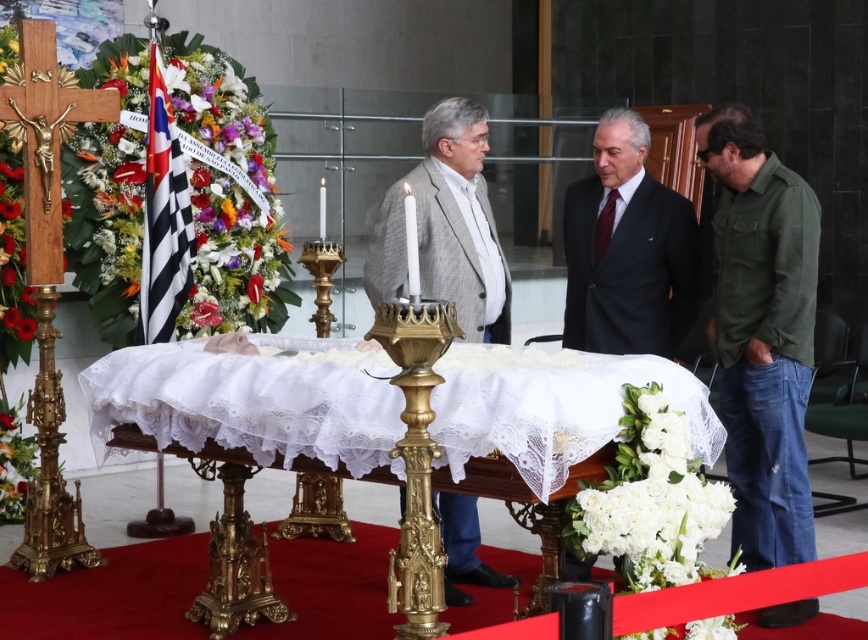
Looking at this image, you are a photographer taking a picture of the funeral scene. You need to ensure that both the white lace cloth at center and the green denim jacket at lower right are clearly visible in the frame. Which object should you adjust your camera focus on first to ensure proper framing?

The white lace cloth at center has a larger width than the green denim jacket at lower right, so you should focus on the white lace cloth at center first to ensure it fits properly in the frame.